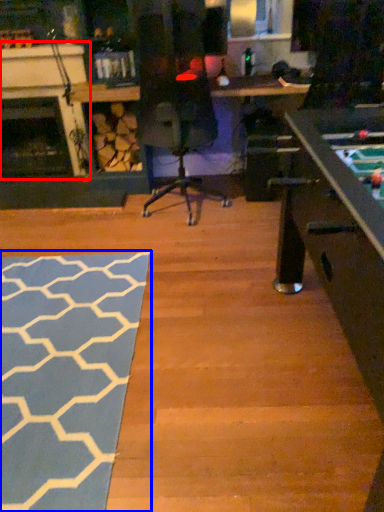
Question: Which object appears closest to the camera in this image, fireplace (highlighted by a red box) or mat (highlighted by a blue box)?

Choices:
 (A) fireplace
 (B) mat

Answer: (B)